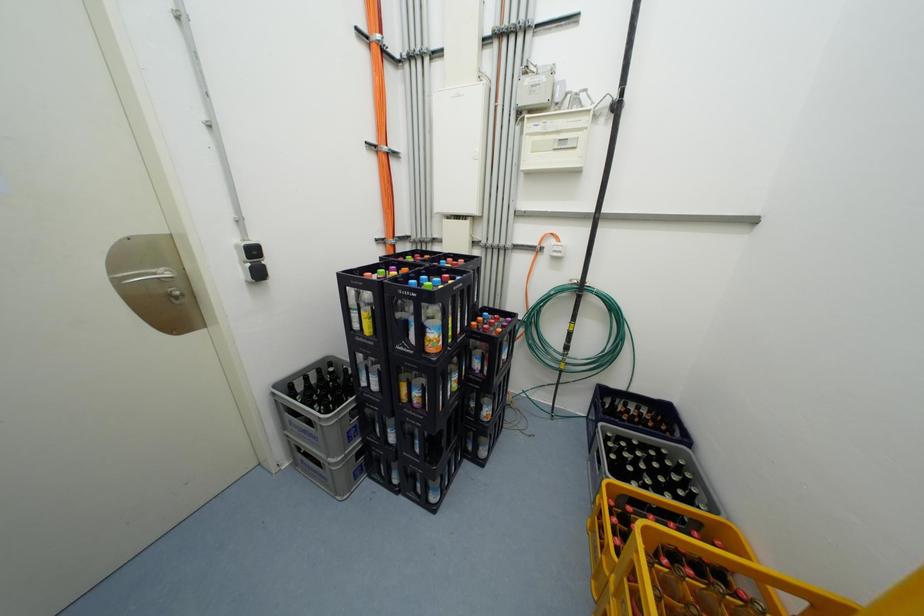
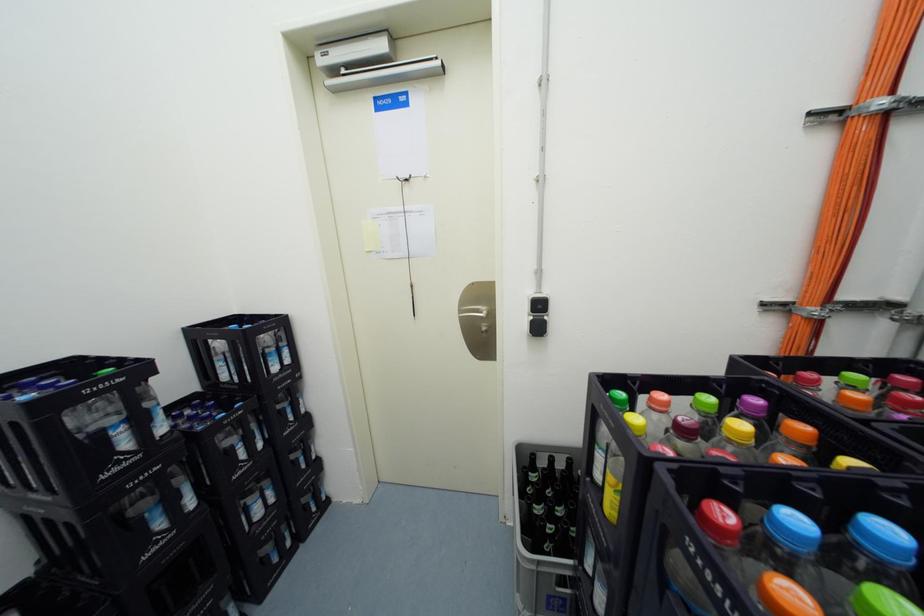
Question: How did the camera likely rotate?

Choices:
 (A) Left
 (B) Right
 (C) Up
 (D) Down

Answer: (A)